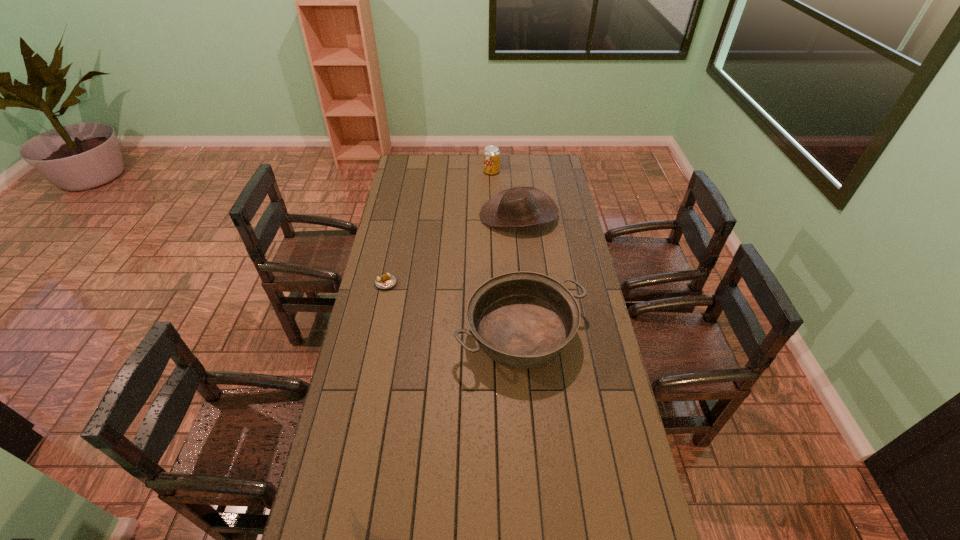
Find the location of a particular element. The image size is (960, 540). the farthest object is located at coordinates (491, 155).

Locate an element on the screen. cowboy hat is located at coordinates (520, 206).

In order to click on the nearest object in this screenshot , I will do `click(522, 320)`.

Locate an element on the screen. Image resolution: width=960 pixels, height=540 pixels. the shortest object is located at coordinates (385, 281).

Identify the location of the third farthest object. This screenshot has height=540, width=960. (385, 281).

Where is `vacant space located on the left of the pop (soda)`? vacant space located on the left of the pop (soda) is located at coordinates (420, 172).

At what (x,y) coordinates should I click in order to perform the action: click on vacant space located on the left of the cowboy hat. Please return your answer as a coordinate pair (x, y). The width and height of the screenshot is (960, 540). Looking at the image, I should click on (407, 215).

Where is `vacant space located on the front of the nearest object`? vacant space located on the front of the nearest object is located at coordinates (533, 471).

I want to click on vacant space located on the front of the pastry, so (x=380, y=314).

Find the location of a particular element. The width and height of the screenshot is (960, 540). object at the far edge is located at coordinates 491,155.